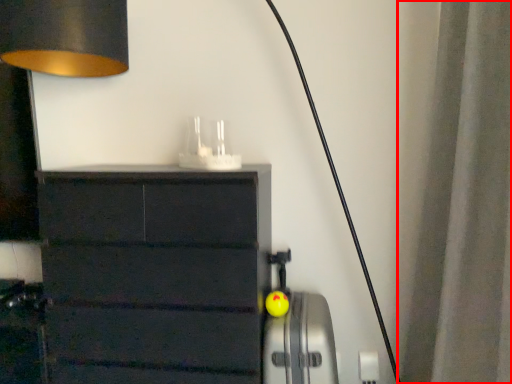
Question: From the image's perspective, where is curtain (annotated by the red box) located in relation to appliance in the image?

Choices:
 (A) below
 (B) above

Answer: (B)